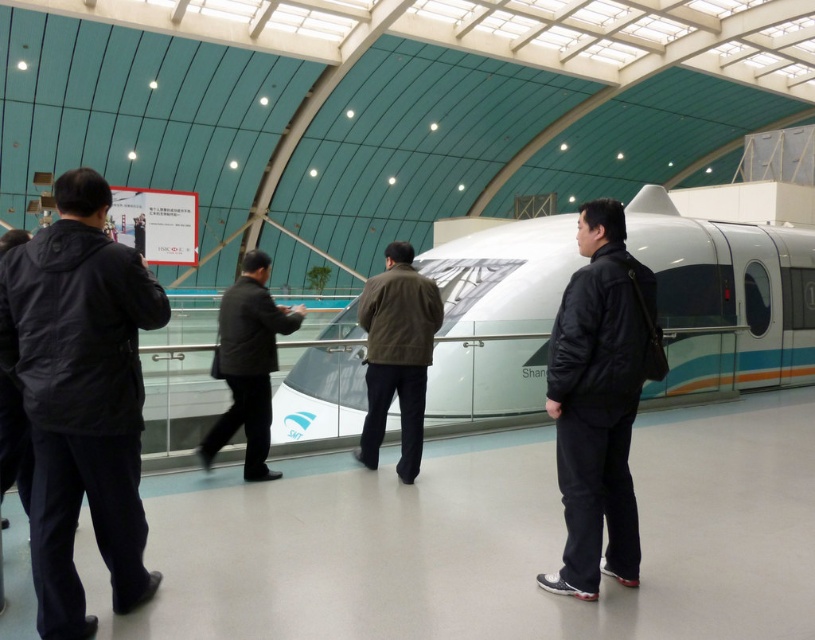
You are a visitor at the station and want to take a photo of the white glossy train at center without any obstruction. Since you are standing near the black matte jacket at left, will the jacket block your view of the train?

The white glossy train at center is wider than the black matte jacket at left, so the jacket will not block your view of the train.

You are standing in the station and want to take a photo of the white glossy train at center without including the black matte jacket at left in the frame. Which direction should you move to achieve this?

Move to the right side of the white glossy train at center to avoid including the black matte jacket at left in the photo.